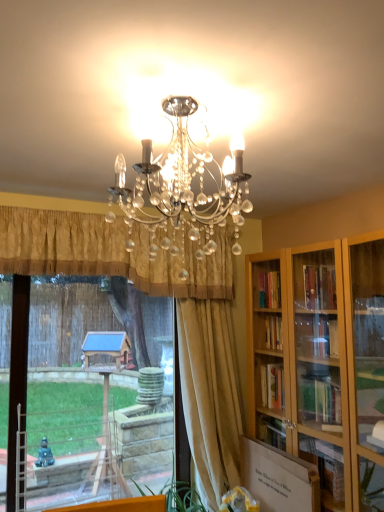
Question: Is silky beige curtain at center, positioned as the first curtain in right-to-left order, not near gold pleated curtain at center, placed as the first curtain when sorted from left to right?

Choices:
 (A) no
 (B) yes

Answer: (A)

Question: Is silky beige curtain at center, positioned as the second curtain in left-to-right order, outside gold pleated curtain at center, placed as the first curtain when sorted from left to right?

Choices:
 (A) yes
 (B) no

Answer: (A)

Question: From a real-world perspective, is silky beige curtain at center, positioned as the first curtain in right-to-left order, positioned under gold pleated curtain at center, acting as the 2th curtain starting from the right, based on gravity?

Choices:
 (A) no
 (B) yes

Answer: (B)

Question: Would you say gold pleated curtain at center, placed as the first curtain when sorted from left to right, is part of silky beige curtain at center, positioned as the second curtain in left-to-right order,'s contents?

Choices:
 (A) no
 (B) yes

Answer: (A)

Question: Does silky beige curtain at center, positioned as the first curtain in right-to-left order, appear on the left side of gold pleated curtain at center, placed as the first curtain when sorted from left to right?

Choices:
 (A) no
 (B) yes

Answer: (A)

Question: From a real-world perspective, is transparent glass window at center above or below silky beige curtain at center, positioned as the second curtain in left-to-right order?

Choices:
 (A) above
 (B) below

Answer: (B)

Question: Is transparent glass window at center taller or shorter than silky beige curtain at center, positioned as the first curtain in right-to-left order?

Choices:
 (A) tall
 (B) short

Answer: (B)

Question: Relative to silky beige curtain at center, positioned as the second curtain in left-to-right order, is transparent glass window at center in front or behind?

Choices:
 (A) behind
 (B) front

Answer: (B)

Question: In terms of size, does transparent glass window at center appear bigger or smaller than silky beige curtain at center, positioned as the second curtain in left-to-right order?

Choices:
 (A) small
 (B) big

Answer: (B)

Question: From the image's perspective, is silky beige curtain at center, positioned as the first curtain in right-to-left order, located above or below transparent glass window at center?

Choices:
 (A) above
 (B) below

Answer: (A)

Question: Would you say silky beige curtain at center, positioned as the first curtain in right-to-left order, is to the left or to the right of transparent glass window at center in the picture?

Choices:
 (A) left
 (B) right

Answer: (B)

Question: From a real-world perspective, is silky beige curtain at center, positioned as the second curtain in left-to-right order, physically located above or below transparent glass window at center?

Choices:
 (A) below
 (B) above

Answer: (B)

Question: Relative to transparent glass window at center, is silky beige curtain at center, positioned as the first curtain in right-to-left order, in front or behind?

Choices:
 (A) front
 (B) behind

Answer: (B)

Question: Is gold pleated curtain at center, acting as the 2th curtain starting from the right, situated inside silky beige curtain at center, positioned as the second curtain in left-to-right order, or outside?

Choices:
 (A) outside
 (B) inside

Answer: (A)

Question: From a real-world perspective, is gold pleated curtain at center, placed as the first curtain when sorted from left to right, above or below silky beige curtain at center, positioned as the second curtain in left-to-right order?

Choices:
 (A) below
 (B) above

Answer: (B)